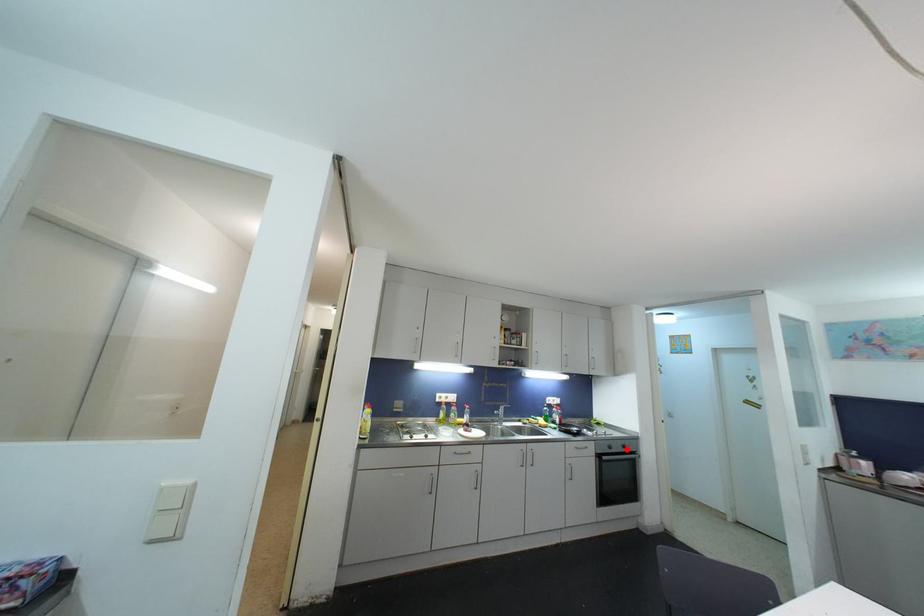
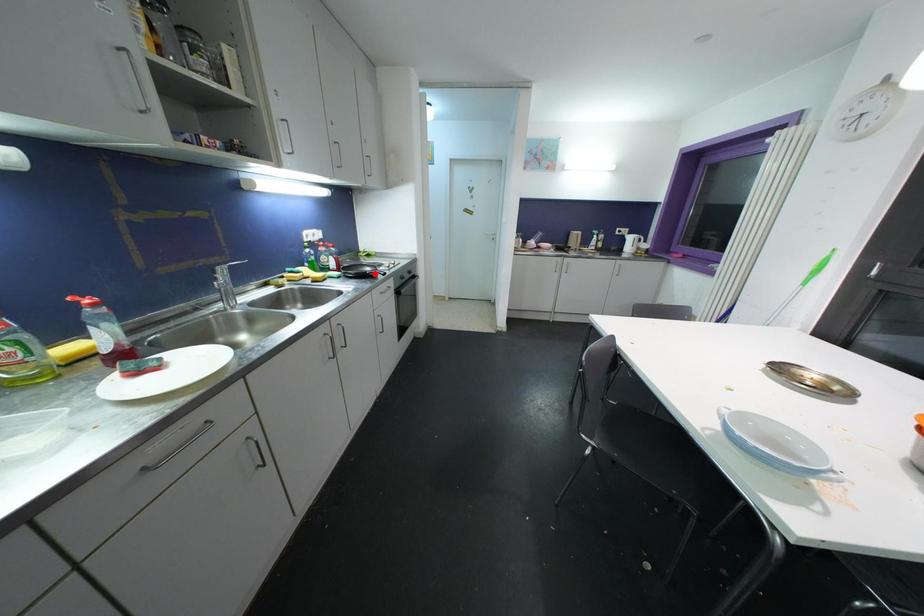
I am providing you with two images of the same scene from different viewpoints. A red point is marked on the first image and another point is marked on the second image. Is the marked point in image1 the same physical position as the marked point in image2?

No